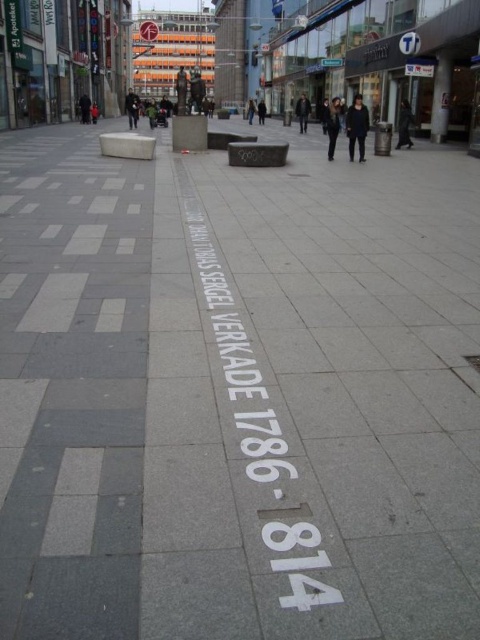
Is white painted text at center thinner than white plastic sign at upper center?

Indeed, white painted text at center has a lesser width compared to white plastic sign at upper center.

Is point (260, 396) behind point (152, 40)?

No.

Is point (292, 518) positioned before point (155, 29)?

That is True.

You are a GUI agent. You are given a task and a screenshot of the screen. Output one action in this format:
    pyautogui.click(x=<x>, y=<y>)
    Task: Click on the white painted text at center
    This screenshot has height=640, width=480.
    Given the screenshot: What is the action you would take?
    pyautogui.click(x=240, y=368)